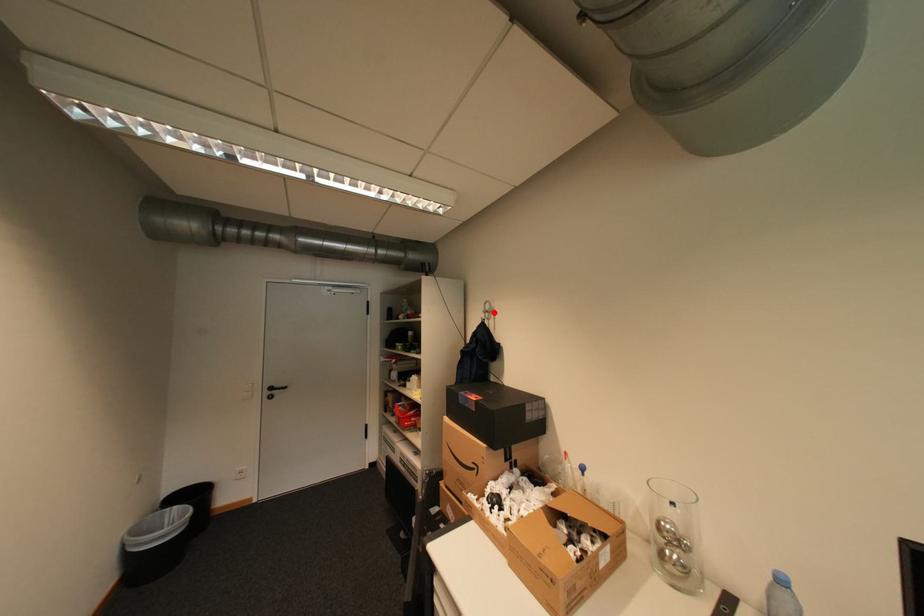
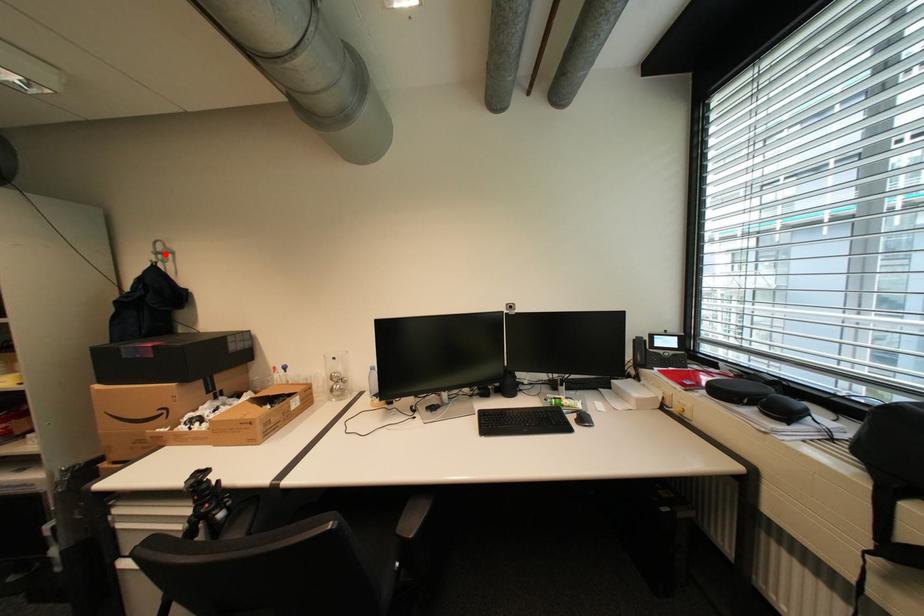
I am providing you with two images of the same scene from different viewpoints. A red point is marked on the first image and another point is marked on the second image. Is the marked point in image1 the same physical position as the marked point in image2?

Yes